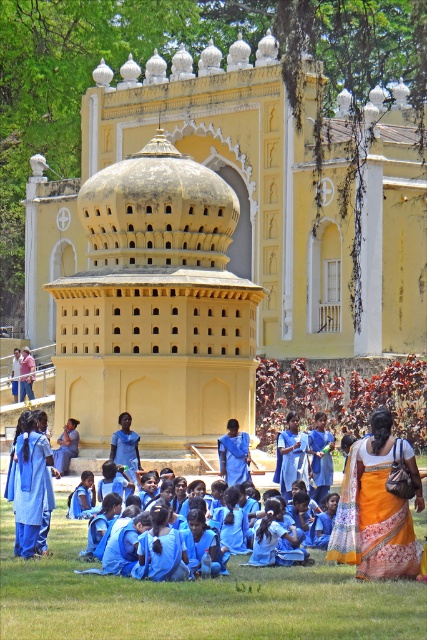
Does yellow matte palace at center have a greater width compared to matte blue dress at center?

Correct, the width of yellow matte palace at center exceeds that of matte blue dress at center.

At what (x,y) coordinates should I click in order to perform the action: click on yellow matte palace at center. Please return your answer as a coordinate pair (x, y). The height and width of the screenshot is (640, 427). Looking at the image, I should click on (215, 241).

Is point (201, 148) closer to camera compared to point (383, 612)?

No.

Can you confirm if yellow matte palace at center is taller than green grass at lower center?

Yes.

Is point (155, 99) positioned in front of point (60, 493)?

No, it is behind (60, 493).

Where is `yellow matte palace at center`? yellow matte palace at center is located at coordinates (215, 241).

Can you confirm if orange printed sari at lower right is smaller than matte blue dress at center?

Actually, orange printed sari at lower right might be larger than matte blue dress at center.

Is orange printed sari at lower right behind matte blue dress at center?

That is False.

Who is more distant from viewer, (x=332, y=557) or (x=131, y=477)?

The point (x=131, y=477) is more distant.

The height and width of the screenshot is (640, 427). Find the location of `orange printed sari at lower right`. orange printed sari at lower right is located at coordinates (377, 508).